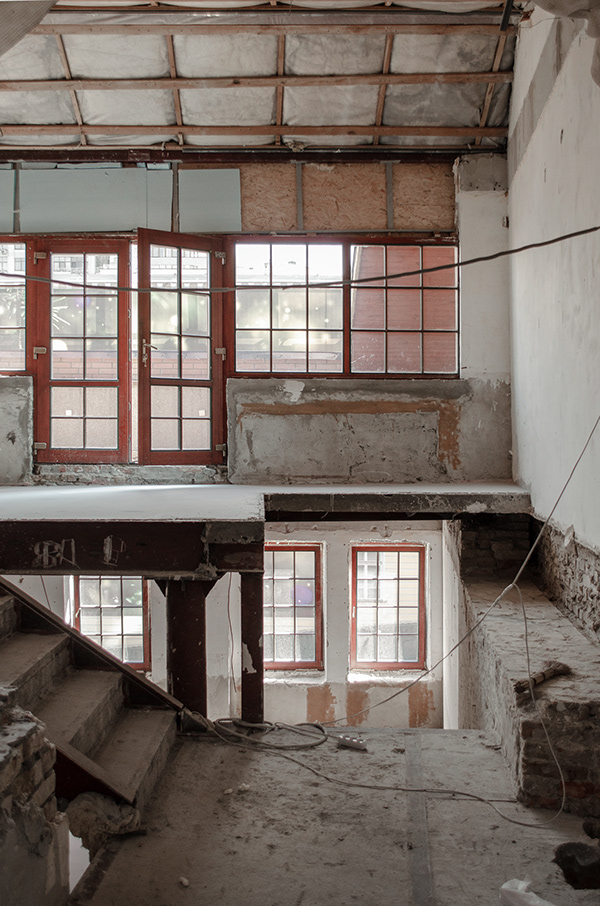
Locate an element on the screen. This screenshot has width=600, height=906. window is located at coordinates (351, 320), (374, 652), (295, 600), (118, 602).